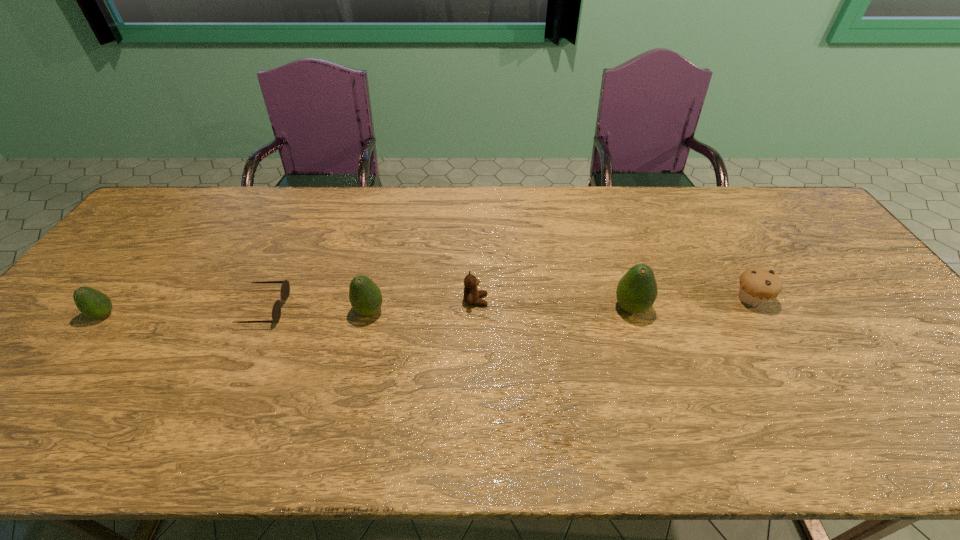
This screenshot has width=960, height=540. In order to click on vacant area in the image that satisfies the following two spatial constraints: 1. on the back side of the fourth object from right to left; 2. on the right side of the shortest avocado in this screenshot , I will do `click(107, 312)`.

Where is `vacant point that satisfies the following two spatial constraints: 1. on the back side of the leftmost avocado; 2. on the right side of the third object from left to right`? vacant point that satisfies the following two spatial constraints: 1. on the back side of the leftmost avocado; 2. on the right side of the third object from left to right is located at coordinates (107, 312).